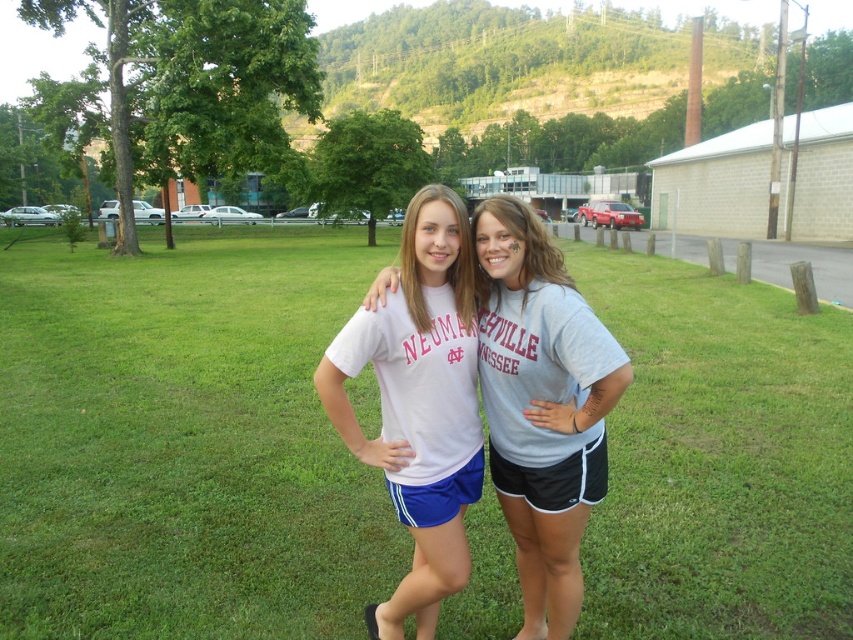
Question: Which of the following is the farthest from the observer?

Choices:
 (A) (573, 529)
 (B) (758, 358)
 (C) (445, 445)

Answer: (B)

Question: Which point appears closest to the camera in this image?

Choices:
 (A) (447, 340)
 (B) (579, 444)
 (C) (26, 326)

Answer: (A)

Question: Can you confirm if green grass at center is positioned below white matte shorts at center?

Choices:
 (A) no
 (B) yes

Answer: (A)

Question: Is green grass at center to the right of white matte t-shirt at center from the viewer's perspective?

Choices:
 (A) yes
 (B) no

Answer: (B)

Question: Does green grass at center have a larger size compared to white matte t-shirt at center?

Choices:
 (A) no
 (B) yes

Answer: (B)

Question: Considering the real-world distances, which object is closest to the white matte t-shirt at center?

Choices:
 (A) white matte shorts at center
 (B) green grass at center

Answer: (A)